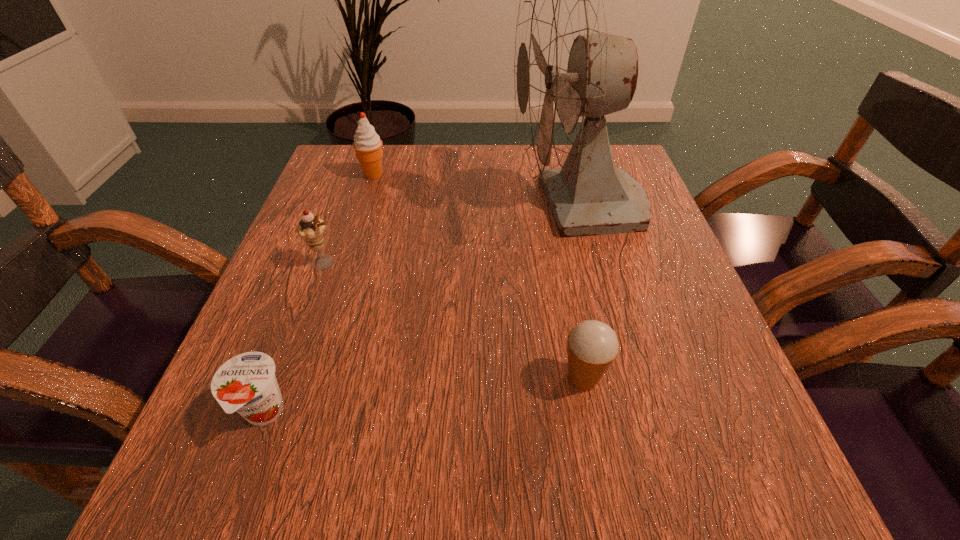
I want to click on object that is at the far right corner, so click(x=569, y=72).

This screenshot has height=540, width=960. What are the coordinates of `vacant space at the far edge of the desktop` in the screenshot? It's located at (488, 193).

In the image, there is a desktop. Where is `vacant space at the right edge`? The width and height of the screenshot is (960, 540). vacant space at the right edge is located at coordinates (683, 299).

This screenshot has width=960, height=540. Find the location of `vacant point at the far left corner`. vacant point at the far left corner is located at coordinates (334, 170).

Locate an element on the screen. This screenshot has width=960, height=540. vacant space at the near left corner of the desktop is located at coordinates (253, 490).

In order to click on vacant space at the far right corner of the desktop in this screenshot , I will do `click(634, 168)`.

Find the location of `free spot between the farthest icecream and the fan`. free spot between the farthest icecream and the fan is located at coordinates (476, 191).

Identify the location of blank region between the tallest object and the shortest object. [x=420, y=310].

Where is `vacant area between the fan and the shortest icecream`? Image resolution: width=960 pixels, height=540 pixels. vacant area between the fan and the shortest icecream is located at coordinates (x=581, y=293).

The image size is (960, 540). Identify the location of free space between the fan and the second shortest object. (581, 293).